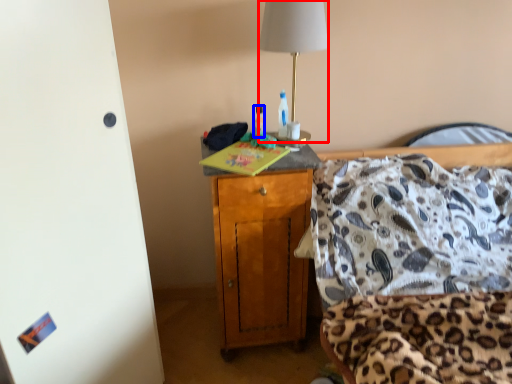
Question: Among these objects, which one is nearest to the camera, lamp (highlighted by a red box) or bottle (highlighted by a blue box)?

Choices:
 (A) lamp
 (B) bottle

Answer: (A)